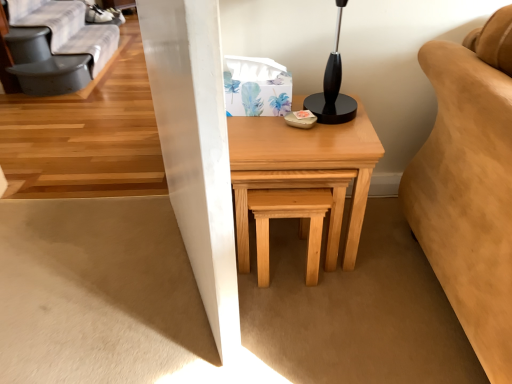
Find the location of `vacant area that is in front of natural wood stool at center`. vacant area that is in front of natural wood stool at center is located at coordinates (297, 310).